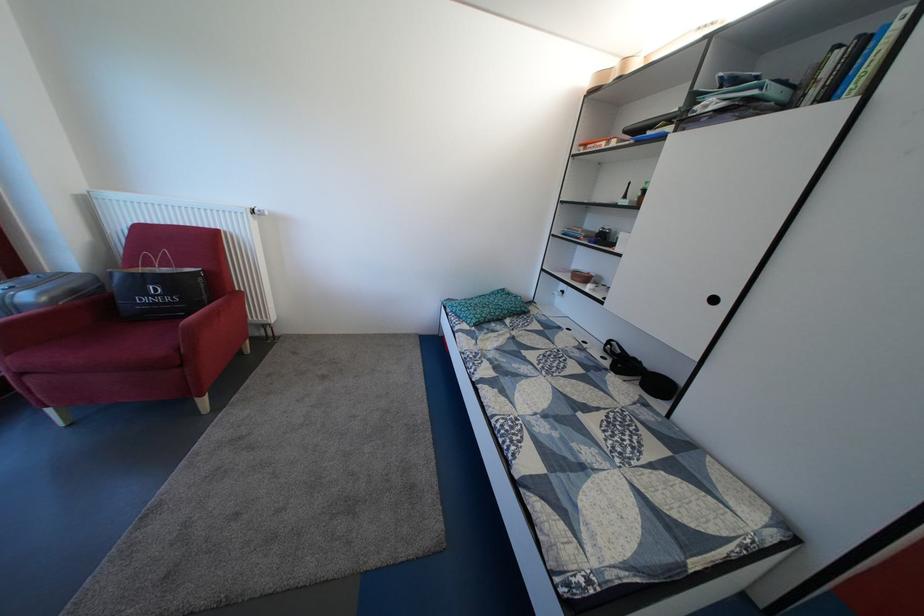
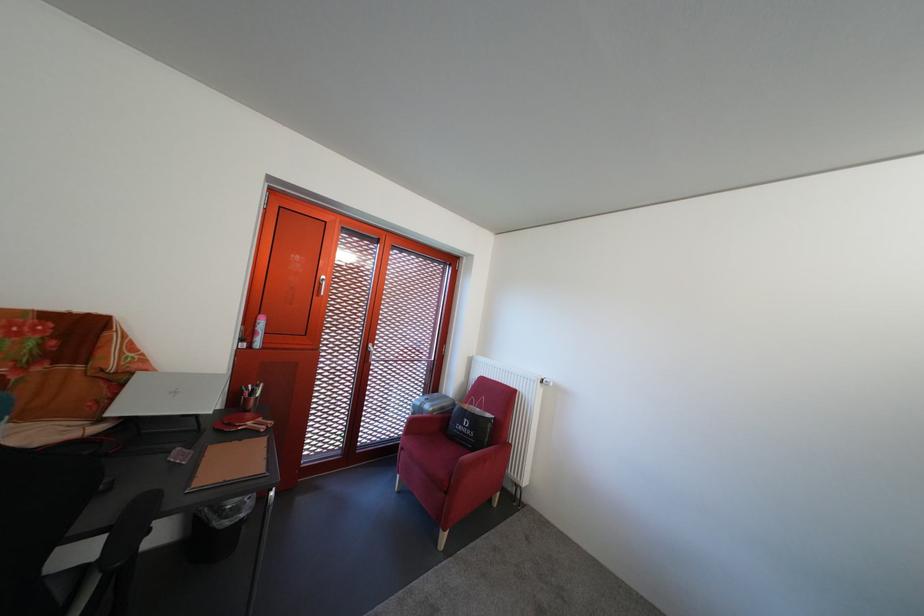
Locate, in the second image, the point that corresponds to (32,381) in the first image.

(412, 456)